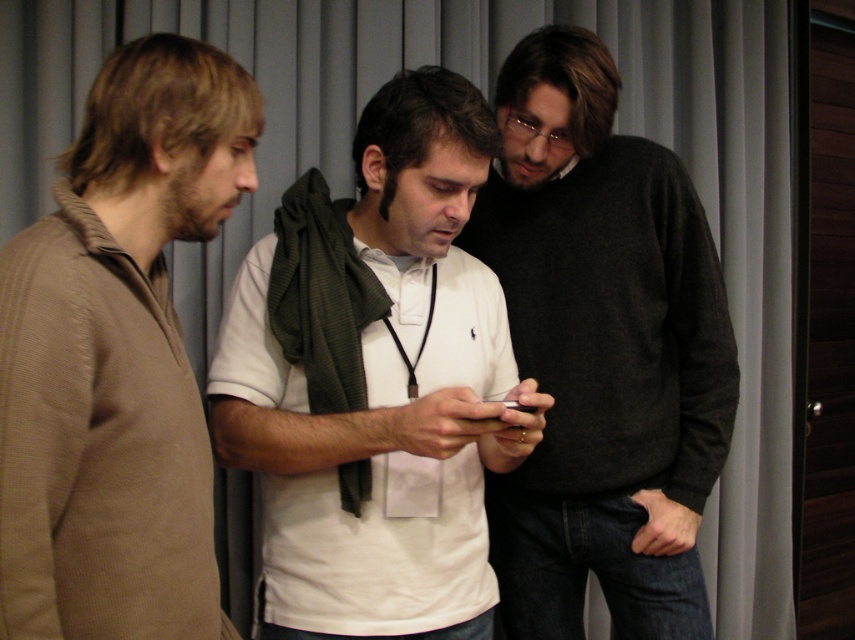
Based on the scene description, can you determine the spatial relationship between the white matte shirt at center and the dark gray sweater at center?

The white matte shirt at center is to the left of the dark gray sweater at center.

From the picture: You are a photographer trying to capture a candid shot of the white matte shirt at center and the dark gray sweater at center. Since you want both subjects to be in focus, which one should you focus on first to ensure the other is also in sharpness?

The white matte shirt at center is in front of the dark gray sweater at center. To ensure both are in focus, you should focus on the white matte shirt at center first, as it is closer to the camera. This way, the depth of field will extend from the white matte shirt at center to the dark gray sweater at center, keeping both sharp.